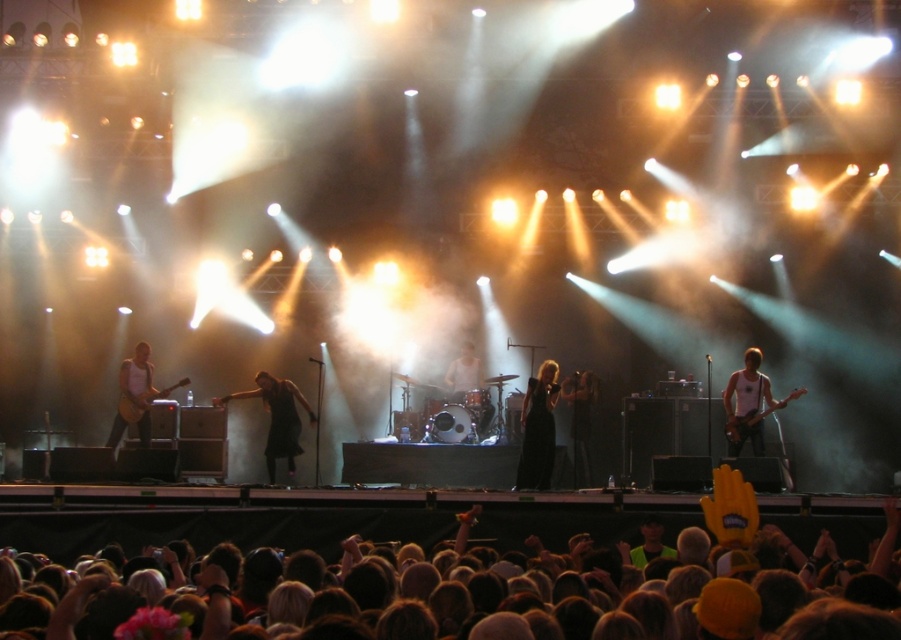
You are a photographer at the concert. You need to capture a closeup shot of both the black velvet dress at center and the black leather jacket at center in the same frame. The camera you are using has a maximum focus range of 9 feet. Can you fit both subjects within the focus range?

The black velvet dress at center is 9.22 feet from the black leather jacket at center, which exceeds the camera focus range of 9 feet. Therefore, you cannot fit both subjects within the focus range.

You are standing at the camera position and want to know how far the point at coordinates [71,496] is from you. Can you determine the distance?

The point at coordinates [71,496] is 51.62 feet away from the camera.

You are a photographer trying to capture the drummer in the center of your shot. The drummer has dark brown hair at lower center. Your camera has a focus point at position 0.8, 0.35. Is the drummer within the focus range of your camera?

The drummer has dark brown hair at lower center located at point (x=315, y=518), which is very close to the camera focus point at (x=314, y=512). The slight difference in coordinates suggests the drummer is within the focus range, so yes, the drummer is within the focus range.